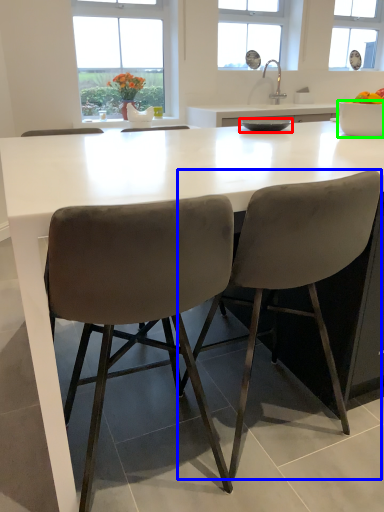
Question: Which object is positioned closest to bowl (highlighted by a red box)? Select from chair (highlighted by a blue box) and bowl (highlighted by a green box).

Choices:
 (A) chair
 (B) bowl

Answer: (B)